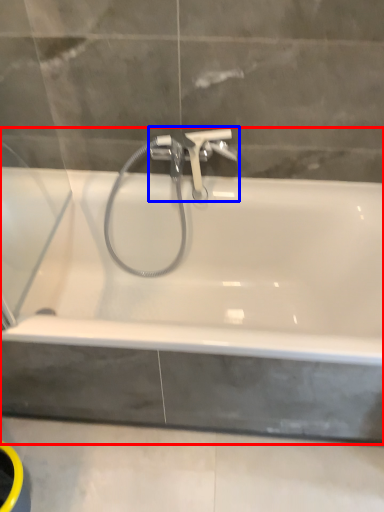
Question: Which object is further to the camera taking this photo, bathtub (highlighted by a red box) or tap (highlighted by a blue box)?

Choices:
 (A) bathtub
 (B) tap

Answer: (B)